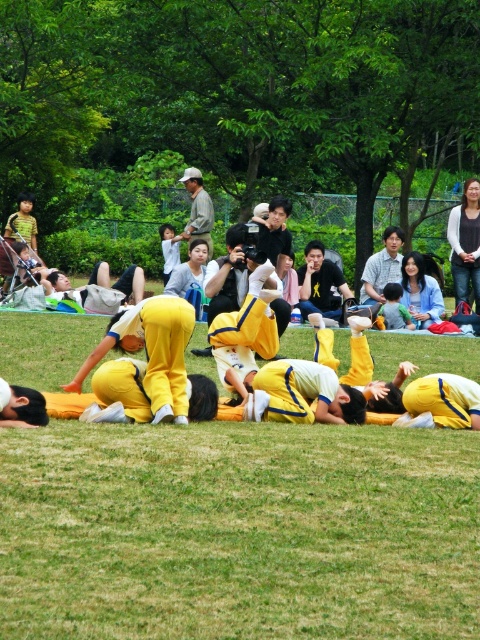
Which of these two, black cotton shirt at upper right or light brown fabric shirt at upper center, stands taller?

light brown fabric shirt at upper center is taller.

Which is more to the right, black cotton shirt at upper right or light brown fabric shirt at upper center?

black cotton shirt at upper right is more to the right.

Does point (458, 291) lie behind point (194, 198)?

No, (458, 291) is in front of (194, 198).

Locate an element on the screen. black cotton shirt at upper right is located at coordinates [466, 243].

Between point (227, 451) and point (199, 186), which one is positioned behind?

The point (199, 186) is more distant.

Does green grass at center appear on the left side of light brown fabric shirt at upper center?

In fact, green grass at center is to the right of light brown fabric shirt at upper center.

What do you see at coordinates (239, 532) in the screenshot? This screenshot has width=480, height=640. I see `green grass at center` at bounding box center [239, 532].

At what (x,y) coordinates should I click in order to perform the action: click on green grass at center. Please return your answer as a coordinate pair (x, y). The width and height of the screenshot is (480, 640). Looking at the image, I should click on (239, 532).

Is black matte shirt at center below light brown fabric shirt at upper center?

Yes.

Is black matte shirt at center above light brown fabric shirt at upper center?

Actually, black matte shirt at center is below light brown fabric shirt at upper center.

Which is in front, point (313, 275) or point (192, 182)?

Point (313, 275) is in front.

This screenshot has height=640, width=480. Find the location of `black matte shirt at center`. black matte shirt at center is located at coordinates (320, 282).